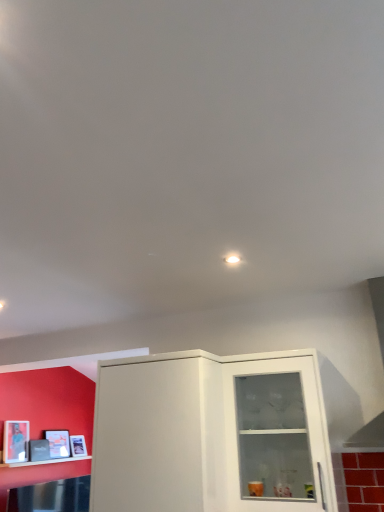
Question: Can you confirm if transparent glass cabinet at center is smaller than white glossy shelf at lower left?

Choices:
 (A) no
 (B) yes

Answer: (A)

Question: From a real-world perspective, is transparent glass cabinet at center located beneath white glossy shelf at lower left?

Choices:
 (A) no
 (B) yes

Answer: (A)

Question: Is transparent glass cabinet at center looking in the opposite direction of white glossy shelf at lower left?

Choices:
 (A) no
 (B) yes

Answer: (A)

Question: From a real-world perspective, is transparent glass cabinet at center located higher than white glossy shelf at lower left?

Choices:
 (A) no
 (B) yes

Answer: (B)

Question: From the image's perspective, does transparent glass cabinet at center appear higher than white glossy shelf at lower left?

Choices:
 (A) yes
 (B) no

Answer: (A)

Question: Would you say transparent glass cabinet at center contains white glossy shelf at lower left?

Choices:
 (A) yes
 (B) no

Answer: (B)

Question: Is matte white cabinet at center taller than transparent glass cabinet at center?

Choices:
 (A) no
 (B) yes

Answer: (B)

Question: Is matte white cabinet at center looking in the opposite direction of transparent glass cabinet at center?

Choices:
 (A) yes
 (B) no

Answer: (B)

Question: Is matte white cabinet at center not near transparent glass cabinet at center?

Choices:
 (A) yes
 (B) no

Answer: (B)

Question: Considering the relative positions of matte white cabinet at center and transparent glass cabinet at center in the image provided, is matte white cabinet at center to the right of transparent glass cabinet at center from the viewer's perspective?

Choices:
 (A) yes
 (B) no

Answer: (B)

Question: Is matte white cabinet at center further to the viewer compared to transparent glass cabinet at center?

Choices:
 (A) yes
 (B) no

Answer: (B)

Question: Is matte white cabinet at center shorter than transparent glass cabinet at center?

Choices:
 (A) no
 (B) yes

Answer: (A)

Question: Can you confirm if white glossy shelf at lower left is shorter than transparent glass cabinet at center?

Choices:
 (A) no
 (B) yes

Answer: (B)